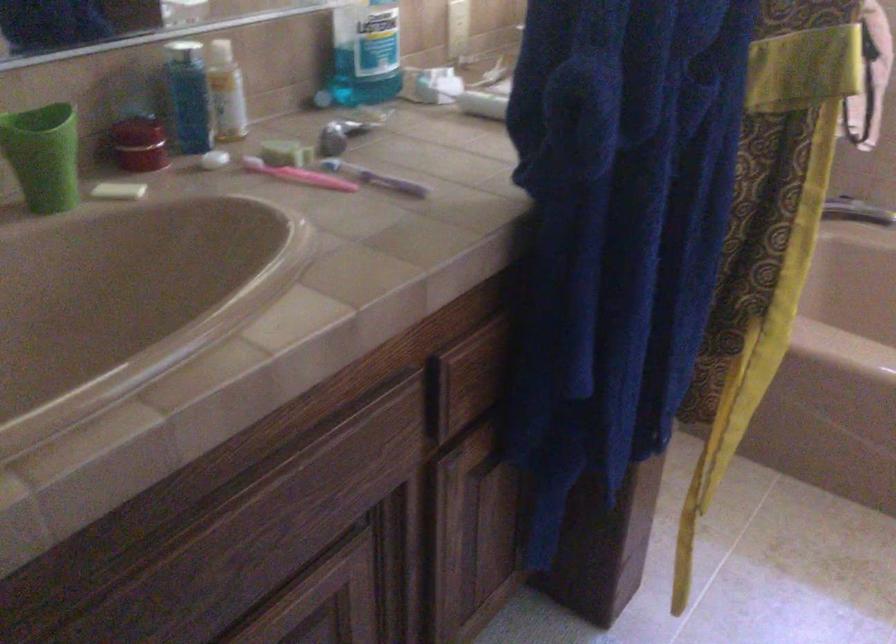
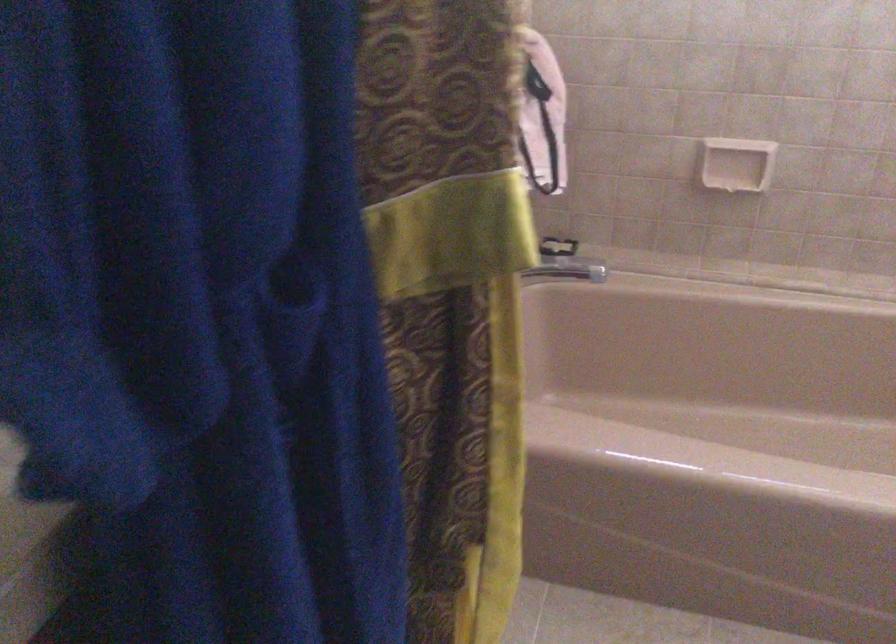
Question: Based on the continuous images, in which direction is the camera rotating? Reply with the corresponding letter.

Choices:
 (A) Left
 (B) Right
 (C) Up
 (D) Down

Answer: (B)